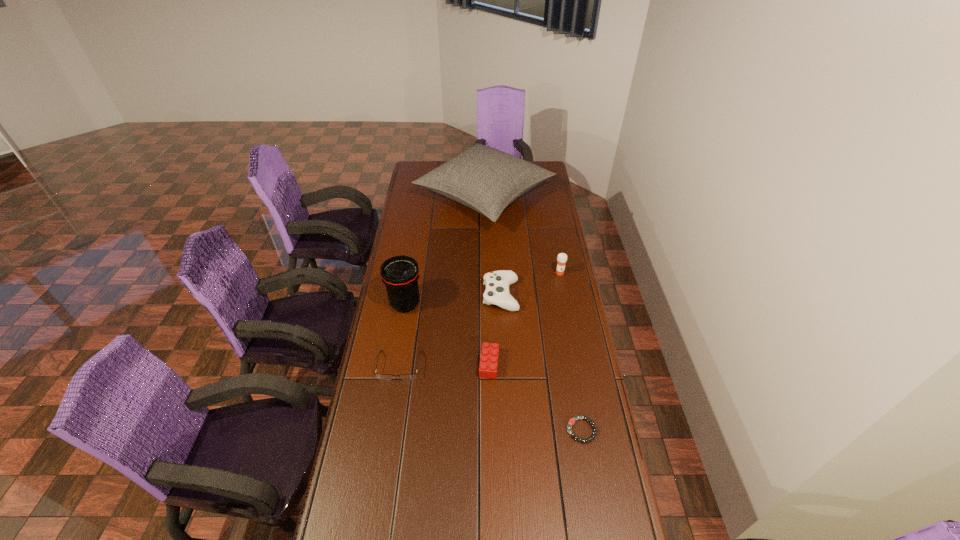
You are a GUI agent. You are given a task and a screenshot of the screen. Output one action in this format:
    pyautogui.click(x=<x>, y=<y>)
    Task: Click on the unoccupied area between the spectacles and the bracelet
    The image size is (960, 540).
    Given the screenshot: What is the action you would take?
    pyautogui.click(x=491, y=398)

This screenshot has width=960, height=540. Identify the location of free space between the sixth tallest object and the medicine. (479, 320).

Where is `free point between the control and the spectacles`? Image resolution: width=960 pixels, height=540 pixels. free point between the control and the spectacles is located at coordinates pos(450,330).

This screenshot has width=960, height=540. Identify the location of empty space that is in between the cushion and the second shortest object. (442, 281).

Where is `empty space that is in between the third shortest object and the medicine`? This screenshot has height=540, width=960. empty space that is in between the third shortest object and the medicine is located at coordinates tap(524, 319).

Identify which object is located as the sixth nearest to the fourth shortest object. Please provide its 2D coordinates. Your answer should be formatted as a tuple, i.e. [(x, y)], where the tuple contains the x and y coordinates of a point satisfying the conditions above.

[(571, 422)]

Select which object is the sixth closest to the telephoto lens. Please provide its 2D coordinates. Your answer should be formatted as a tuple, i.e. [(x, y)], where the tuple contains the x and y coordinates of a point satisfying the conditions above.

[(571, 422)]

This screenshot has height=540, width=960. Find the location of `free space that satisfies the following two spatial constraints: 1. on the front side of the bracelet; 2. on the left side of the fourth tallest object`. free space that satisfies the following two spatial constraints: 1. on the front side of the bracelet; 2. on the left side of the fourth tallest object is located at coordinates (507, 430).

This screenshot has height=540, width=960. In order to click on free location that satisfies the following two spatial constraints: 1. on the front-facing side of the spectacles; 2. on the right side of the shortest object in this screenshot , I will do `click(389, 430)`.